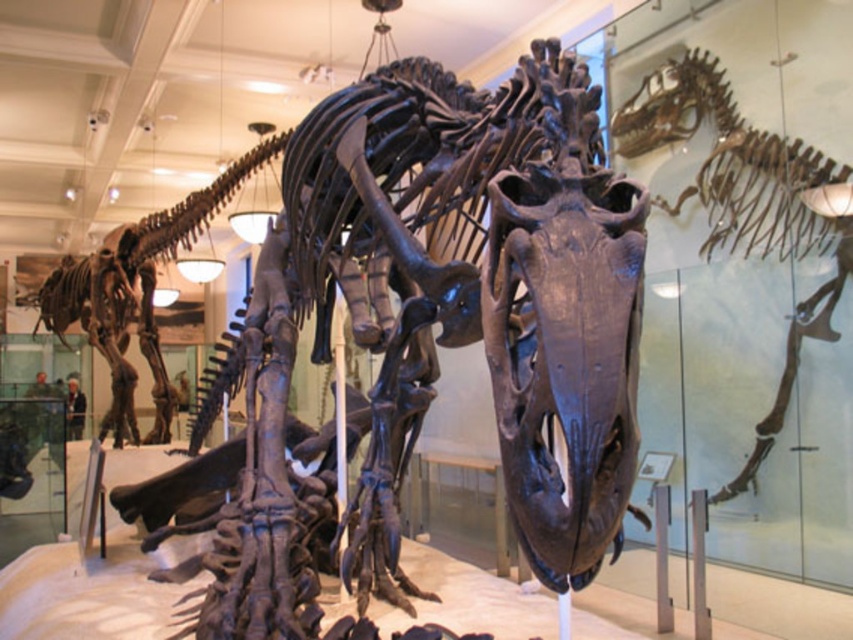
Question: Is brown bone-like skull at center in front of shiny metallic dinosaur at center?

Choices:
 (A) yes
 (B) no

Answer: (A)

Question: Where is brown bone-like skull at center located in relation to shiny metallic dinosaur at center in the image?

Choices:
 (A) above
 (B) below

Answer: (A)

Question: Which of the following is the closest to the observer?

Choices:
 (A) (779, 228)
 (B) (195, 208)

Answer: (A)

Question: Is brown bone-like skull at center positioned at the back of shiny metallic dinosaur at center?

Choices:
 (A) yes
 (B) no

Answer: (B)